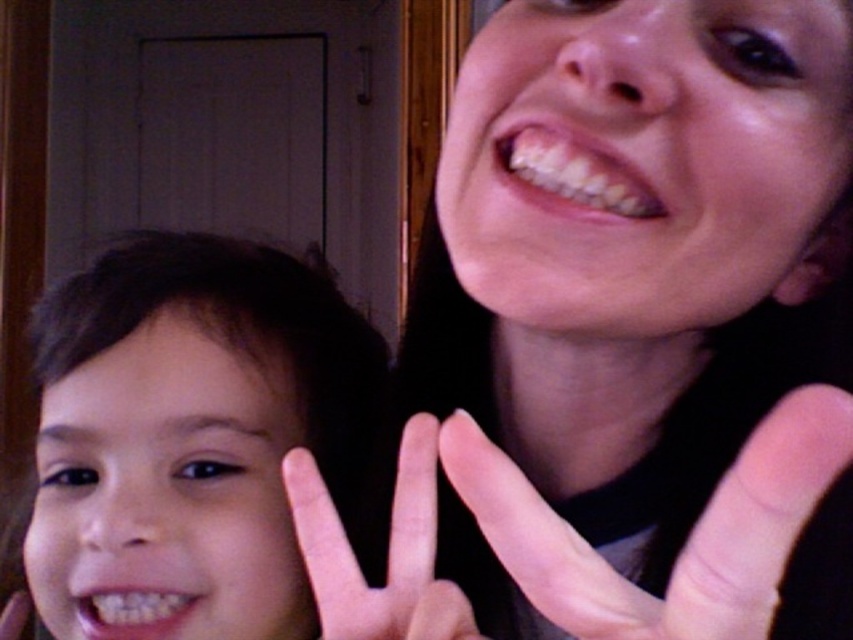
You are a photographer taking a portrait and you have a camera with a focal length of 50mm. You want to capture the smooth skin face at upper right in focus while keeping the background slightly blurred. Based on the distance provided, is this achievable?

The smooth skin face at upper right is 6.03 inches away from the viewer. With a 50mm lens, achieving a blurred background while focusing on a subject so close would be challenging because the depth of field at such a short distance is very shallow, making it difficult to blur the background significantly.

You are a photographer trying to focus on the smooth skin face at upper right. Given that the camera is set to focus on the point at coordinates point (x=637, y=326), can you confirm if this point is correctly positioned on the smooth skin face at upper right?

Yes, the point (x=637, y=326) is correctly positioned on the smooth skin face at upper right as the Objects Description states that the point corresponds to it.